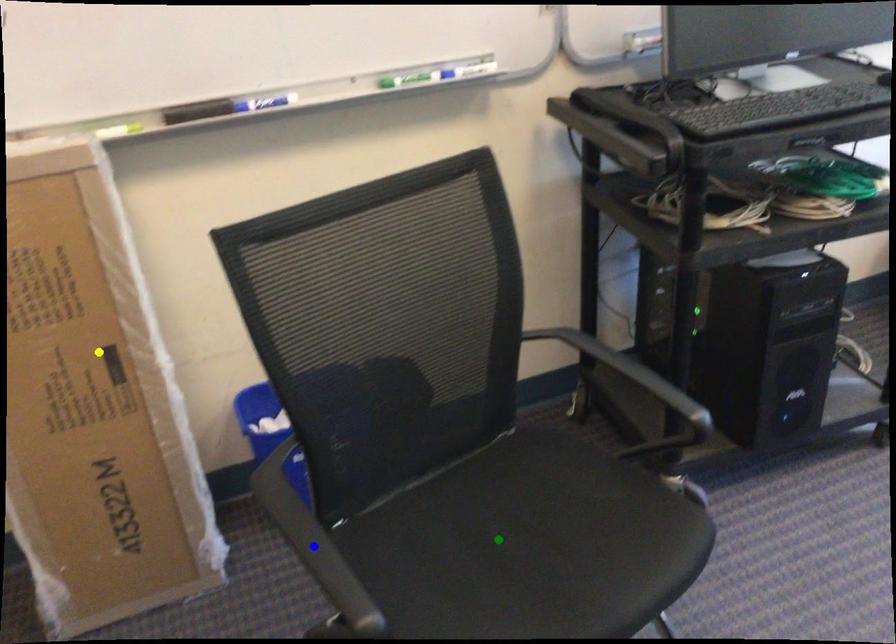
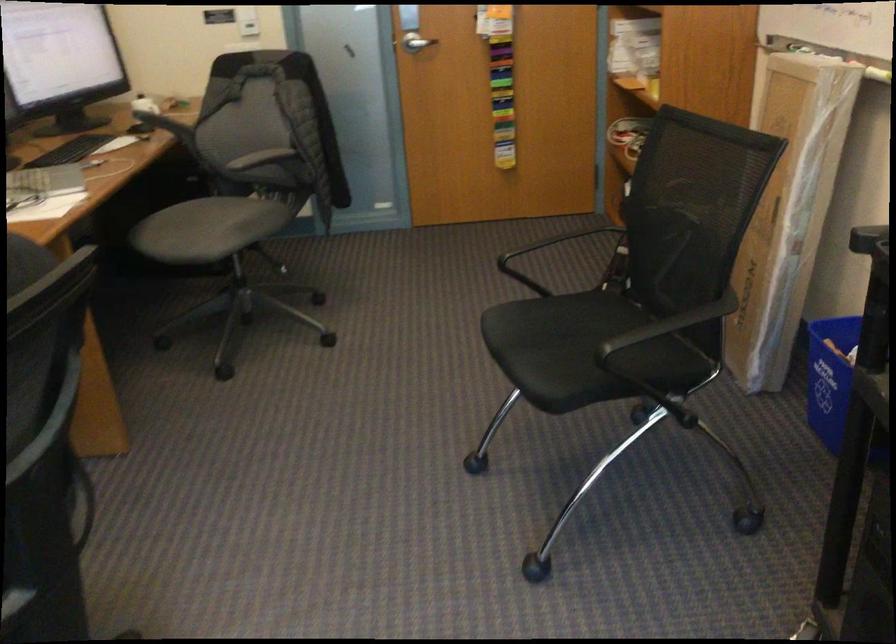
I am providing you with two images of the same scene from different viewpoints. Three points are marked in image1. Which point corresponds to a part or object that is occluded in image2?In image1, three points are marked. Which of them correspond to a part or object that is occluded in image2?Among the three points shown in image1, which one corresponds to a part or object that is no longer visible due to occlusion in image2?

Invisible in image2: blue point.